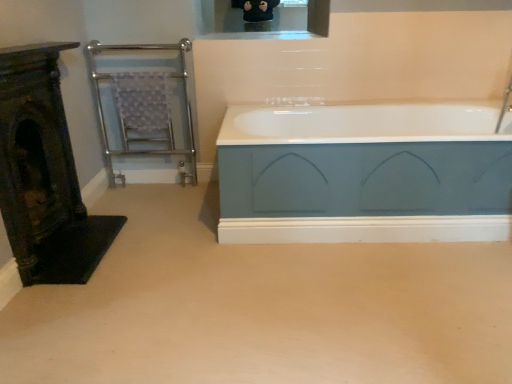
At what (x,y) coordinates should I click in order to perform the action: click on vacant area that is in front of teal matte bathtub at center. Please return your answer as a coordinate pair (x, y). The height and width of the screenshot is (384, 512). Looking at the image, I should click on (365, 292).